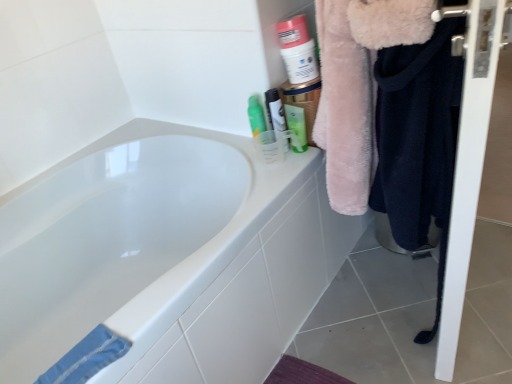
The image size is (512, 384). Identify the location of vacant space in front of green matte tube at upper right, marked as the 1th mouthwash in a right-to-left arrangement. (289, 166).